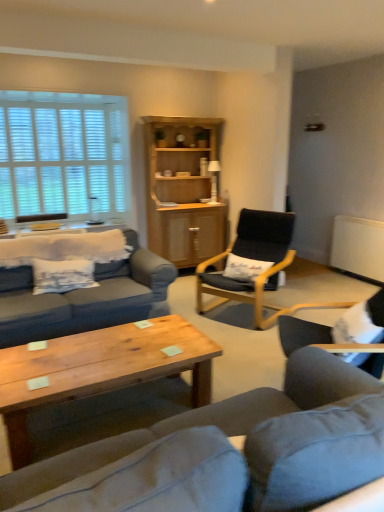
This screenshot has width=384, height=512. I want to click on wooden table at left, so click(64, 227).

Describe the element at coordinates (64, 227) in the screenshot. I see `wooden table at left` at that location.

Describe the element at coordinates (99, 369) in the screenshot. The height and width of the screenshot is (512, 384). I see `wooden coffee table at center` at that location.

You are a GUI agent. You are given a task and a screenshot of the screen. Output one action in this format:
    pyautogui.click(x=<x>, y=<y>)
    Task: Click on the wooden coffee table at center
    
    Given the screenshot: What is the action you would take?
    pyautogui.click(x=99, y=369)

Describe the element at coordinates (244, 268) in the screenshot. I see `white fabric pillow at center` at that location.

The image size is (384, 512). In order to click on white fur chair at lower right, acting as the 2th chair starting from the back in this screenshot , I will do pyautogui.click(x=333, y=327).

At what (x,y) coordinates should I click in order to perform the action: click on white wooden blinds at upper left. Please return your answer as a coordinate pair (x, y). The width and height of the screenshot is (384, 512). Looking at the image, I should click on (63, 154).

Identify the location of black fabric chair at center, the 2th chair when ordered from front to back. This screenshot has width=384, height=512. (252, 259).

Measure the distance between matte gray couch at center and camera.

matte gray couch at center and camera are 1.16 meters apart.

Measure the distance between point (274, 490) and camera.

The depth of point (274, 490) is 3.31 feet.

Identify the location of wooden table at left. (64, 227).

Identify the location of chair on the right of white fabric pillow at center. This screenshot has height=512, width=384. 333,327.

From a real-world perspective, who is located lower, white fabric pillow at center or white fur chair at lower right, acting as the 2th chair starting from the back?

In real-world perspective, white fabric pillow at center is lower.

Looking at this image, what's the angular difference between white fabric pillow at center and white fur chair at lower right, arranged as the first chair when viewed from the front,'s facing directions?

68.2 degrees separate the facing orientations of white fabric pillow at center and white fur chair at lower right, arranged as the first chair when viewed from the front.

Can you confirm if white fabric pillow at center is smaller than white fur chair at lower right, arranged as the first chair when viewed from the front?

Correct, white fabric pillow at center occupies less space than white fur chair at lower right, arranged as the first chair when viewed from the front.

In the scene shown: Is wooden table at left aimed at white fabric pillow at center?

No, wooden table at left does not turn towards white fabric pillow at center.

Can white fabric pillow at center be found inside wooden table at left?

Actually, white fabric pillow at center is outside wooden table at left.

From the image's perspective, which object appears higher, wooden table at left or white fabric pillow at center?

wooden table at left appears higher in the image.

Is the surface of wooden table at left in direct contact with white fabric pillow at center?

wooden table at left is not next to white fabric pillow at center, and they're not touching.

Looking at this image, who is bigger, white fabric pillow at center or light wood cabinet at center?

light wood cabinet at center is bigger.

From a real-world perspective, is white fabric pillow at center on top of light wood cabinet at center?

No, from a real-world perspective, white fabric pillow at center is not above light wood cabinet at center.

Is white fabric pillow at center outside of light wood cabinet at center?

Absolutely, white fabric pillow at center is external to light wood cabinet at center.

How far apart are white fabric pillow at center and light wood cabinet at center?

1.31 meters.

Are white fabric pillow at center and matte gray couch at center located far from each other?

Yes.

Find the location of a particular element. pillow that is above the matte gray couch at center (from a real-world perspective) is located at coordinates (244, 268).

From the picture: How many degrees apart are the facing directions of white fabric pillow at center and matte gray couch at center?

white fabric pillow at center and matte gray couch at center are facing 119 degrees away from each other.

Is white fabric pillow at center inside the boundaries of matte gray couch at center, or outside?

white fabric pillow at center is not inside matte gray couch at center, it's outside.

From the image's perspective, is white fabric pillow at center located above white wooden blinds at upper left?

Incorrect, from the image's perspective, white fabric pillow at center is lower than white wooden blinds at upper left.

Is point (233, 256) positioned before point (101, 100)?

Yes.

Looking at this image, can you confirm if white fabric pillow at center is taller than white wooden blinds at upper left?

In fact, white fabric pillow at center may be shorter than white wooden blinds at upper left.

In terms of size, does white fabric pillow at center appear bigger or smaller than white wooden blinds at upper left?

Considering their sizes, white fabric pillow at center takes up less space than white wooden blinds at upper left.

What's the angular difference between light wood cabinet at center and white fur chair at lower right, arranged as the first chair when viewed from the front,'s facing directions?

There is a 128-degree angle between the facing directions of light wood cabinet at center and white fur chair at lower right, arranged as the first chair when viewed from the front.

Considering the points (207, 147) and (290, 330), which point is behind, point (207, 147) or point (290, 330)?

The point (207, 147) is behind.

In the image, is light wood cabinet at center positioned in front of or behind white fur chair at lower right, arranged as the first chair when viewed from the front?

light wood cabinet at center is positioned farther from the viewer than white fur chair at lower right, arranged as the first chair when viewed from the front.

In terms of height, does matte gray couch at center look taller or shorter compared to white fur chair at lower right, arranged as the first chair when viewed from the front?

Clearly, matte gray couch at center is taller compared to white fur chair at lower right, arranged as the first chair when viewed from the front.

Considering the positions of objects matte gray couch at center and white fur chair at lower right, arranged as the first chair when viewed from the front, in the image provided, who is in front, matte gray couch at center or white fur chair at lower right, arranged as the first chair when viewed from the front,?

matte gray couch at center is closer to the camera.

Is matte gray couch at center facing away from white fur chair at lower right, arranged as the first chair when viewed from the front?

No, white fur chair at lower right, arranged as the first chair when viewed from the front, is not at the back of matte gray couch at center.

Between matte gray couch at center and white fur chair at lower right, acting as the 2th chair starting from the back, which one has smaller size?

With smaller size is white fur chair at lower right, acting as the 2th chair starting from the back.

Starting from the white fabric pillow at center, which chair is the 2nd one in front? Please provide its 2D coordinates.

[(333, 327)]

This screenshot has width=384, height=512. I want to click on table above the white fabric pillow at center (from a real-world perspective), so click(64, 227).

Considering their positions, is wooden coffee table at center positioned further to white fur chair at lower right, arranged as the first chair when viewed from the front, than light wood cabinet at center?

The object further to white fur chair at lower right, arranged as the first chair when viewed from the front, is light wood cabinet at center.

Considering their positions, is black fabric chair at center, the 1th chair positioned from the back, positioned closer to wooden coffee table at center than matte gray couch at center?

The object closer to wooden coffee table at center is matte gray couch at center.

Considering their positions, is matte gray couch at center positioned closer to wooden coffee table at center than white wooden blinds at upper left?

Among the two, matte gray couch at center is located nearer to wooden coffee table at center.

Based on the photo, estimate the real-world distances between objects in this image. Which object is closer to white fabric pillow at center, white fur chair at lower right, arranged as the first chair when viewed from the front, or light wood cabinet at center?

white fur chair at lower right, arranged as the first chair when viewed from the front, is positioned closer to the anchor white fabric pillow at center.

Based on the photo, considering their positions, is white fabric pillow at center positioned further to black fabric chair at center, the 2th chair when ordered from front to back, than wooden table at left?

Based on the image, wooden table at left appears to be further to black fabric chair at center, the 2th chair when ordered from front to back.

Which object lies further to the anchor point wooden coffee table at center, white fur chair at lower right, acting as the 2th chair starting from the back, or light wood cabinet at center?

Among the two, light wood cabinet at center is located further to wooden coffee table at center.

Based on their spatial positions, is white wooden blinds at upper left or light wood cabinet at center closer to wooden coffee table at center?

The object closer to wooden coffee table at center is light wood cabinet at center.

Estimate the real-world distances between objects in this image. Which object is further from black fabric chair at center, the 2th chair when ordered from front to back, wooden coffee table at center or white wooden blinds at upper left?

white wooden blinds at upper left is further to black fabric chair at center, the 2th chair when ordered from front to back.

Find the location of a particular element. pillow between black fabric chair at center, the 2th chair when ordered from front to back, and light wood cabinet at center, along the z-axis is located at coordinates (244, 268).

At what (x,y) coordinates should I click in order to perform the action: click on chair positioned between white fur chair at lower right, acting as the 2th chair starting from the back, and white fabric pillow at center from near to far. Please return your answer as a coordinate pair (x, y). Looking at the image, I should click on (252, 259).

You are a GUI agent. You are given a task and a screenshot of the screen. Output one action in this format:
    pyautogui.click(x=<x>, y=<y>)
    Task: Click on the coffee table between matte gray couch at center and light wood cabinet at center along the z-axis
    
    Given the screenshot: What is the action you would take?
    pyautogui.click(x=99, y=369)

Where is `table located between white wooden blinds at upper left and white fur chair at lower right, acting as the 2th chair starting from the back, in the left-right direction`? The image size is (384, 512). table located between white wooden blinds at upper left and white fur chair at lower right, acting as the 2th chair starting from the back, in the left-right direction is located at coordinates (64, 227).